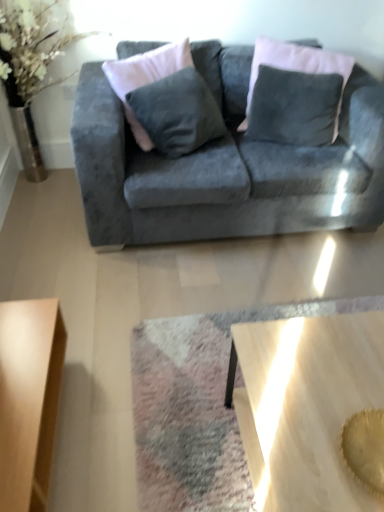
Question: In the image, is light brown wooden coffee table at lower left, which ranks as the 2th coffee table in right-to-left order, on the left side or the right side of wooden polished coffee table at lower center, which is the 1th coffee table from right to left?

Choices:
 (A) left
 (B) right

Answer: (A)

Question: Would you say light brown wooden coffee table at lower left, which ranks as the 2th coffee table in right-to-left order, is inside or outside wooden polished coffee table at lower center, which is the 1th coffee table from right to left?

Choices:
 (A) inside
 (B) outside

Answer: (B)

Question: Estimate the real-world distances between objects in this image. Which object is farther from the velvet gray couch at center?

Choices:
 (A) wooden polished coffee table at lower center, which is the 1th coffee table from right to left
 (B) velvet dark gray pillow at upper center
 (C) light brown wooden coffee table at lower left, which ranks as the 2th coffee table in right-to-left order

Answer: (A)

Question: Which object is the closest to the velvet dark gray pillow at upper center?

Choices:
 (A) light brown wooden coffee table at lower left, the first coffee table viewed from the left
 (B) velvet gray couch at center
 (C) wooden polished coffee table at lower center, arranged as the second coffee table when viewed from the left

Answer: (B)